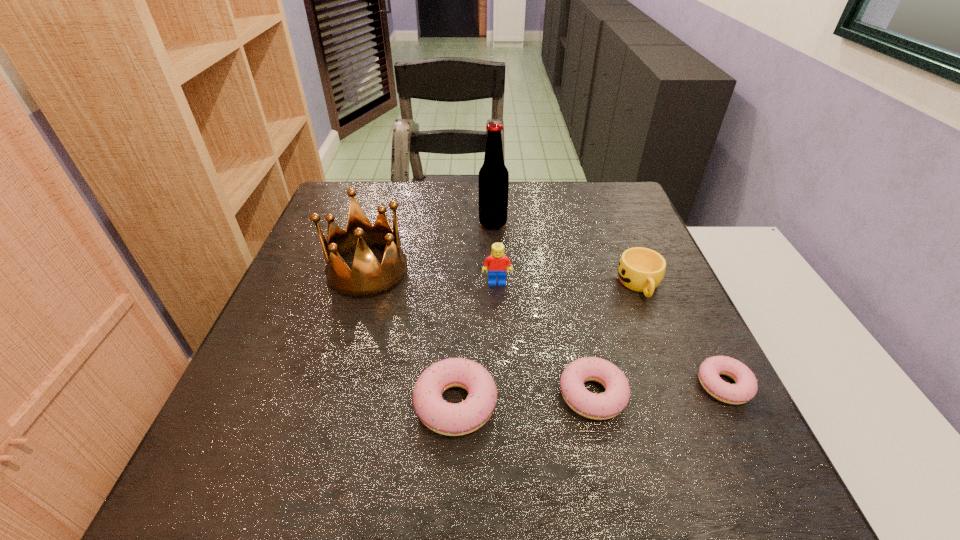
Where is `the second closest doughnut to the shortest doughnut`? The image size is (960, 540). the second closest doughnut to the shortest doughnut is located at coordinates (450, 419).

The height and width of the screenshot is (540, 960). Find the location of `free location that satisfies the following two spatial constraints: 1. on the face of the Lego; 2. on the right side of the sixth tallest object`. free location that satisfies the following two spatial constraints: 1. on the face of the Lego; 2. on the right side of the sixth tallest object is located at coordinates click(502, 394).

You are a GUI agent. You are given a task and a screenshot of the screen. Output one action in this format:
    pyautogui.click(x=<x>, y=<y>)
    Task: Click on the vacant region that satisfies the following two spatial constraints: 1. on the face of the second shortest object; 2. on the right side of the third tallest object
    
    Given the screenshot: What is the action you would take?
    pyautogui.click(x=502, y=394)

Identify the location of free space in the image that satisfies the following two spatial constraints: 1. on the back side of the tallest object; 2. on the left side of the leftmost object. (382, 224).